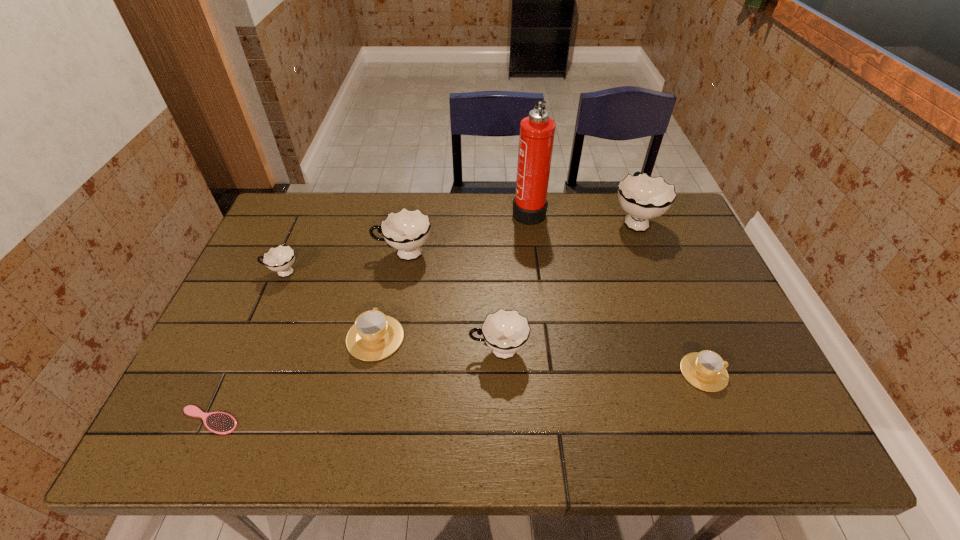
The image size is (960, 540). Identify the location of red fire extinguisher. (536, 138).

Locate an element on the screen. The height and width of the screenshot is (540, 960). the tallest object is located at coordinates (536, 138).

Locate an element on the screen. the tallest cup is located at coordinates (643, 197).

Identify the location of the biggest white cup. (643, 197).

Identify the location of the second biggest white cup. (406, 230).

Find the location of `the sixth shortest object`. the sixth shortest object is located at coordinates (406, 230).

Identify the location of the fourth tallest object. This screenshot has width=960, height=540. tap(505, 331).

Locate an element on the screen. The image size is (960, 540). the third white cup from left to right is located at coordinates (505, 331).

Image resolution: width=960 pixels, height=540 pixels. I want to click on the leftmost white cup, so click(x=280, y=259).

The width and height of the screenshot is (960, 540). I want to click on the smallest white cup, so click(x=280, y=259).